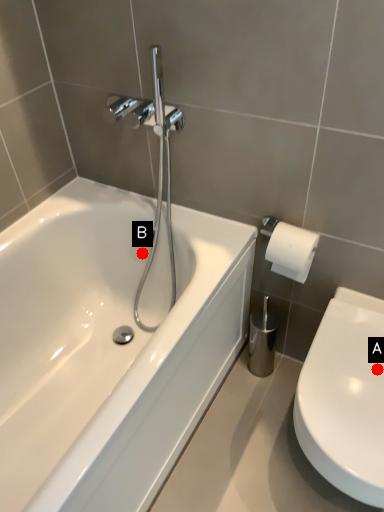
Question: Two points are circled on the image, labeled by A and B beside each circle. Which point is farther to the camera?

Choices:
 (A) A is further
 (B) B is further

Answer: (B)